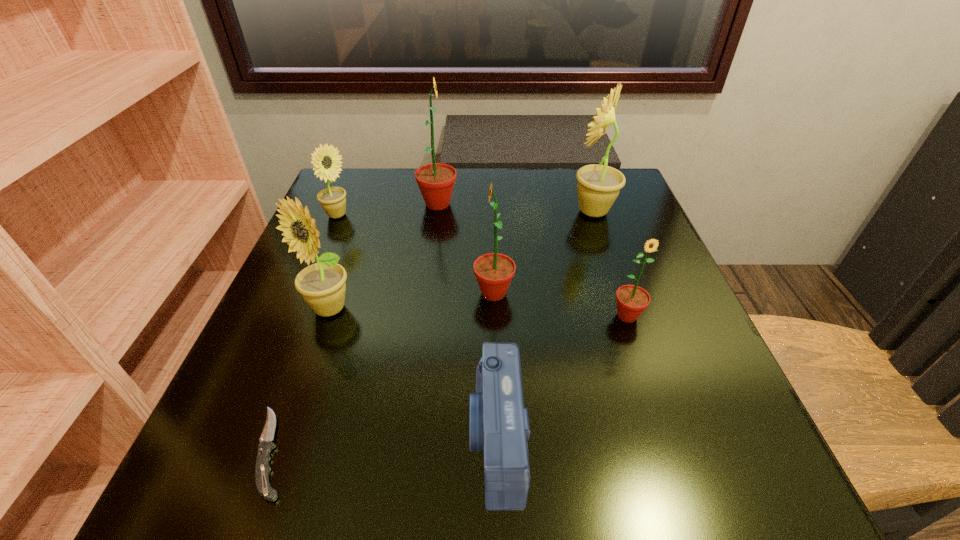
Where is `free location located 0.140m on the face of the rightmost yellow sunflower`? This screenshot has width=960, height=540. free location located 0.140m on the face of the rightmost yellow sunflower is located at coordinates (511, 211).

Find the location of `free space located on the face of the rightmost yellow sunflower`. free space located on the face of the rightmost yellow sunflower is located at coordinates (401, 211).

Where is `vacant area situated on the face of the rightmost yellow sunflower`? vacant area situated on the face of the rightmost yellow sunflower is located at coordinates (481, 211).

Find the location of a particular element. The height and width of the screenshot is (540, 960). free spot located 0.320m on the face of the leftmost green sunflower is located at coordinates (588, 204).

I want to click on free region located 0.280m on the face of the fourth sunflower from left to right, so click(x=327, y=293).

The height and width of the screenshot is (540, 960). Identify the location of vacant area located on the face of the fourth sunflower from left to right. (421, 293).

This screenshot has width=960, height=540. In order to click on vacant space located 0.190m on the face of the fourth sunflower from left to right in this screenshot , I will do `click(374, 293)`.

Locate an element on the screen. free space located 0.080m on the face of the second biggest yellow sunflower is located at coordinates (309, 364).

Find the location of a particular element. The width and height of the screenshot is (960, 540). free region located on the face of the smallest yellow sunflower is located at coordinates (428, 215).

You are a GUI agent. You are given a task and a screenshot of the screen. Output one action in this format:
    pyautogui.click(x=<x>, y=<y>)
    Task: Click on the vacant space located 0.240m on the face of the rightmost green sunflower
    The image size is (960, 540).
    Given the screenshot: What is the action you would take?
    pyautogui.click(x=676, y=461)